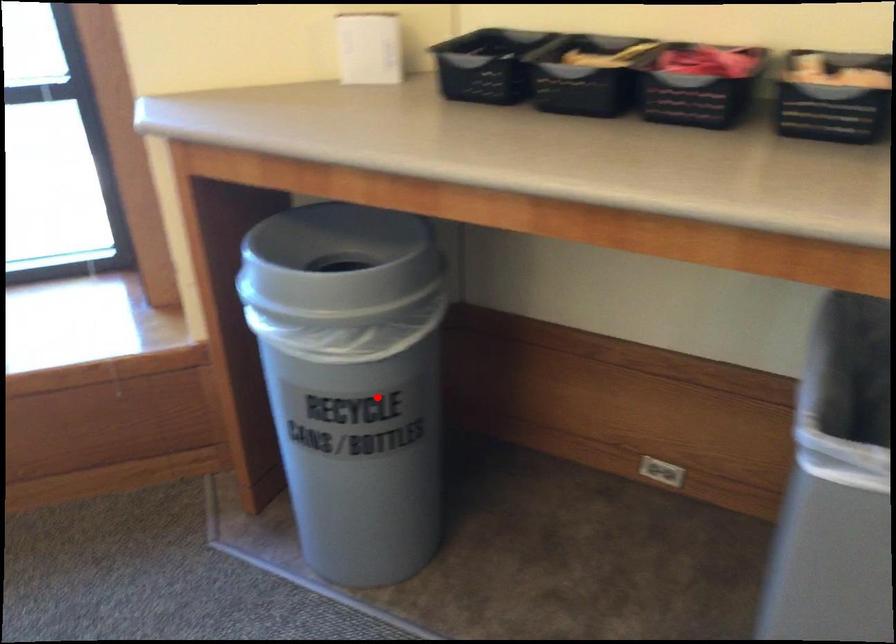
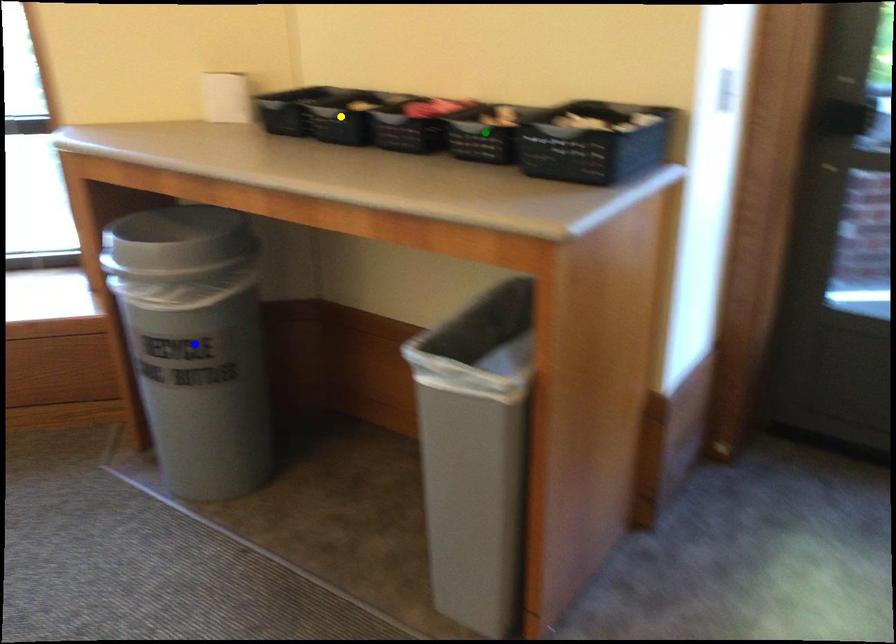
Question: I am providing you with two images of the same scene from different viewpoints. A red point is marked on the first image. You are given multiple points on the second image. Which point in image 2 is actually the same real-world point as the red point in image 1?

Choices:
 (A) yellow point
 (B) blue point
 (C) green point

Answer: (B)